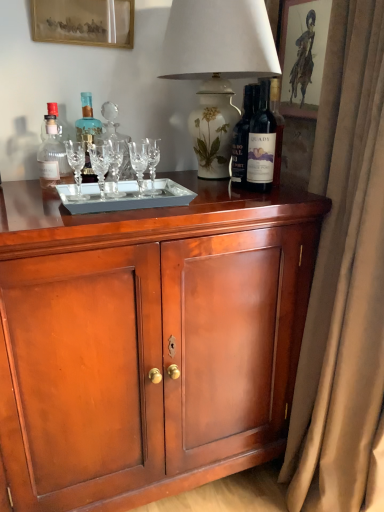
Question: From a real-world perspective, is matte glass bottle at left, the first bottle from the left, above or below blue glass bottle at center, positioned as the second bottle in left-to-right order?

Choices:
 (A) below
 (B) above

Answer: (A)

Question: Does point (62, 165) appear closer or farther from the camera than point (92, 133)?

Choices:
 (A) farther
 (B) closer

Answer: (B)

Question: Estimate the real-world distances between objects in this image. Which object is farther from the dark glass bottle at upper right, which ranks as the third bottle in left-to-right order?

Choices:
 (A) gold-framed picture at upper left, marked as the first picture frame in a left-to-right arrangement
 (B) white floral vase at upper center
 (C) blue glass bottle at center, positioned as the second bottle in left-to-right order
 (D) beige velvet curtain at right
 (E) mahogany cabinet at center

Answer: (A)

Question: Which of these objects is positioned farthest from the dark glass bottle at upper right, arranged as the 1th bottle when viewed from the right?

Choices:
 (A) matte brown picture frame at upper right, which ranks as the 2th picture frame in left-to-right order
 (B) beige velvet curtain at right
 (C) matte glass bottle at left, the first bottle from the left
 (D) mahogany cabinet at center
 (E) gold-framed picture at upper left, marked as the first picture frame in a left-to-right arrangement

Answer: (C)